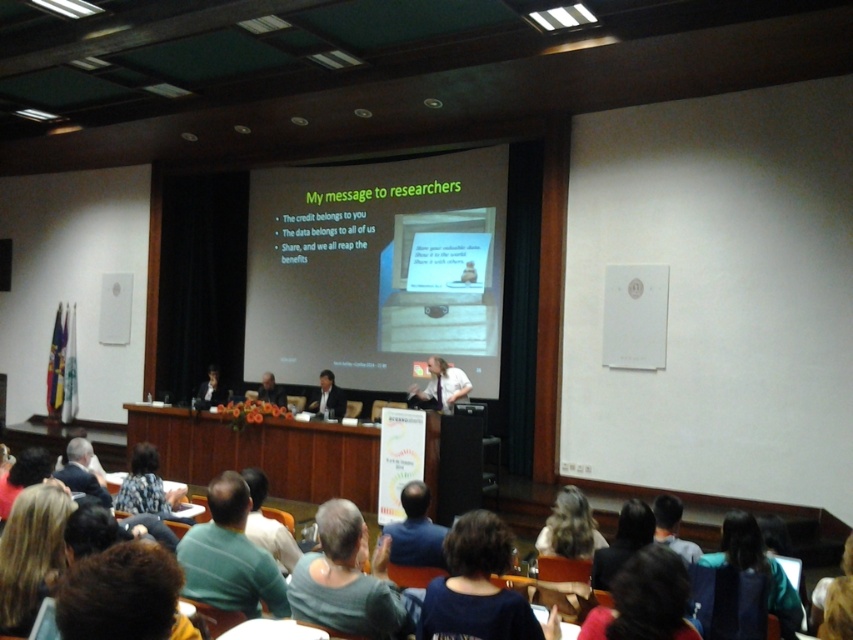
Can you confirm if green fabric shirt at lower center is shorter than dark brown hair at lower left?

Incorrect, green fabric shirt at lower center's height does not fall short of dark brown hair at lower left's.

Between point (282, 580) and point (19, 532), which one is positioned behind?

The point (282, 580) is more distant.

Locate an element on the screen. green fabric shirt at lower center is located at coordinates (230, 556).

Image resolution: width=853 pixels, height=640 pixels. Describe the element at coordinates (757, 566) in the screenshot. I see `dark green fabric at lower right` at that location.

Does dark green fabric at lower right lie in front of silky brown hair at lower right?

No.

You are a GUI agent. You are given a task and a screenshot of the screen. Output one action in this format:
    pyautogui.click(x=<x>, y=<y>)
    Task: Click on the dark green fabric at lower right
    
    Given the screenshot: What is the action you would take?
    pyautogui.click(x=757, y=566)

Find the location of a particular element. Image resolution: width=853 pixels, height=640 pixels. dark green fabric at lower right is located at coordinates (757, 566).

Who is positioned more to the left, green fabric shirt at lower center or dark green fabric at lower right?

green fabric shirt at lower center is more to the left.

Can you confirm if green fabric shirt at lower center is smaller than dark green fabric at lower right?

Incorrect, green fabric shirt at lower center is not smaller in size than dark green fabric at lower right.

Is point (287, 608) positioned behind point (785, 586)?

That is False.

At what (x,y) coordinates should I click in order to perform the action: click on green fabric shirt at lower center. Please return your answer as a coordinate pair (x, y). This screenshot has height=640, width=853. Looking at the image, I should click on (230, 556).